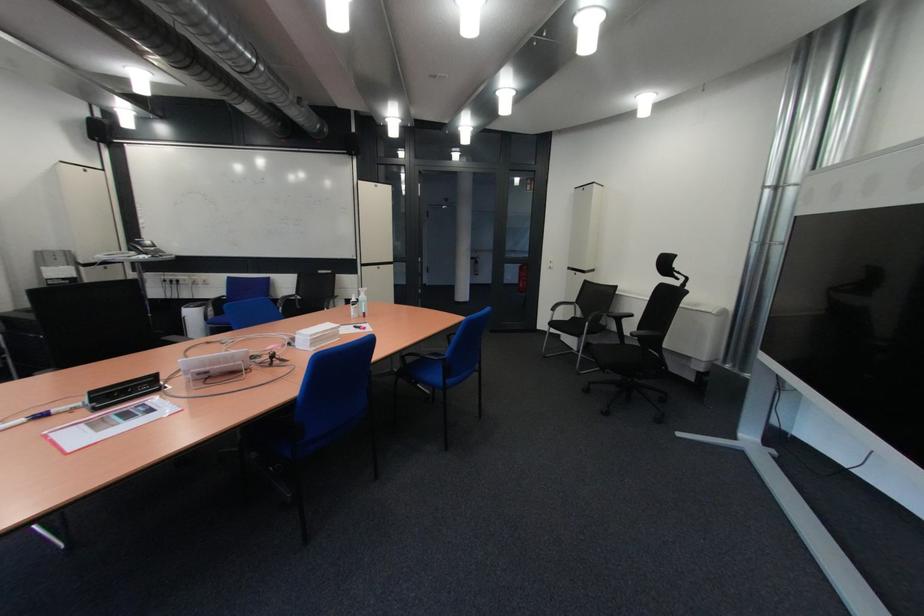
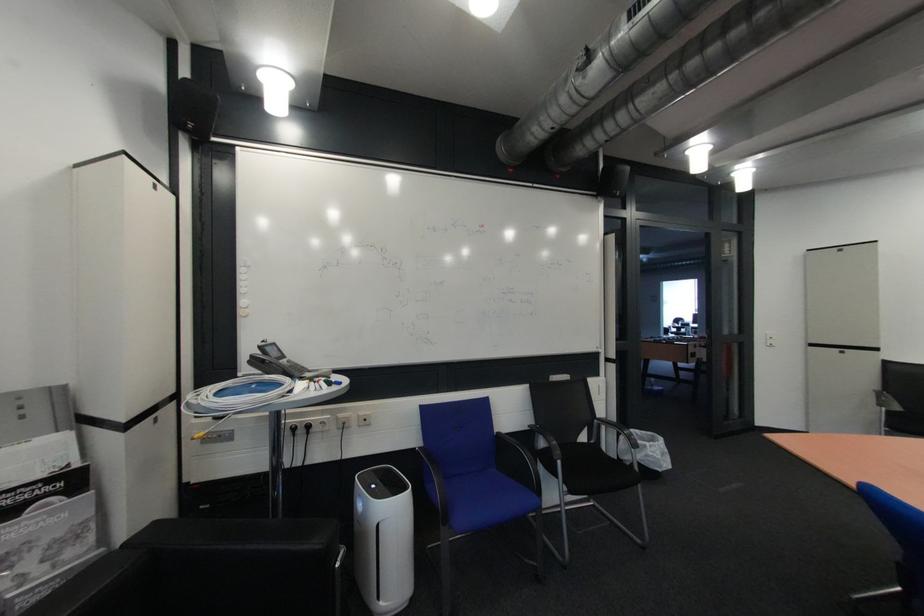
In a continuous first-person perspective shot, in which direction is the camera moving?

The cameraman moved toward left, forward.